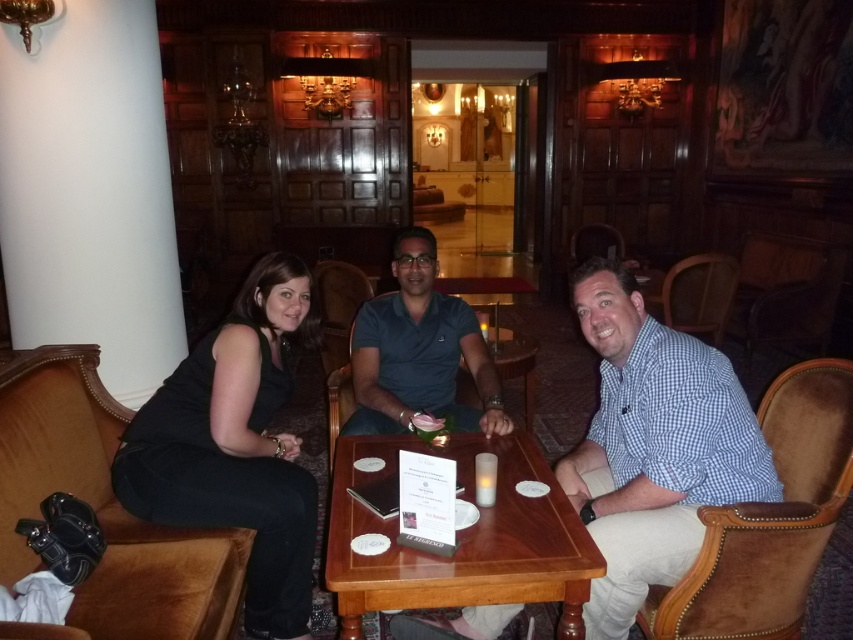
You are a photographer positioned at the center of the room. You want to capture a photo of the black fabric dress at left without including the man in the center. Is the dress positioned to the left or right of the man?

The black fabric dress at left is located to the left of the man in the center, so positioning the camera to the left side would exclude the man while capturing the dress.

You are a photographer standing behind the black fabric dress at left and the white frosted glass at table center. Which object is closer to you?

The black fabric dress at left is closer to you since the white frosted glass at table center is behind it.

You are a photographer setting up for a group photo. The scene has a black fabric dress at left and a blue cotton polo shirt at center. To ensure both subjects are in frame, should you adjust your camera angle to the left or right?

Since the black fabric dress at left is to the left of the blue cotton polo shirt at center, you should adjust your camera angle to the right to include both subjects in the frame.